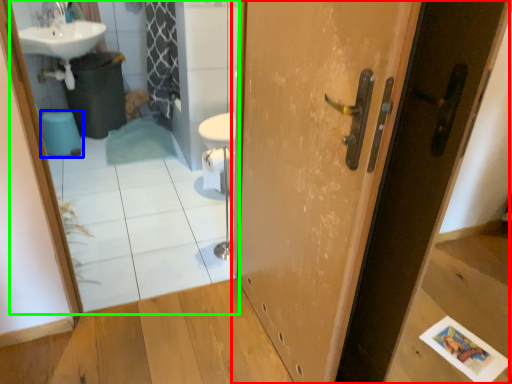
Question: Which object is positioned closest to door (highlighted by a red box)? Select from toilet bowl (highlighted by a blue box) and mirror (highlighted by a green box).

Choices:
 (A) toilet bowl
 (B) mirror

Answer: (B)